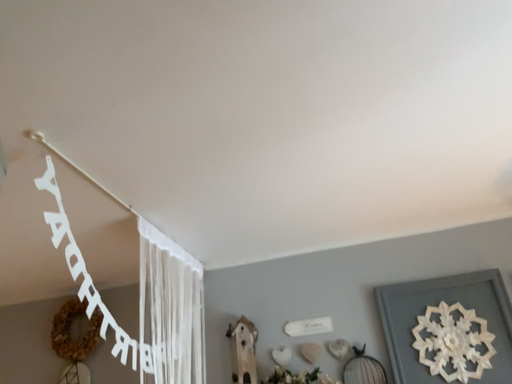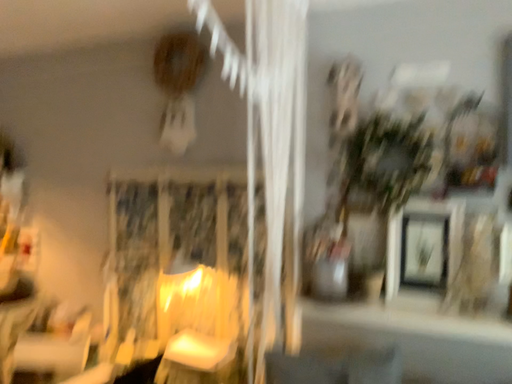
Question: Which way did the camera rotate in the video?

Choices:
 (A) rotated upward
 (B) rotated downward

Answer: (B)